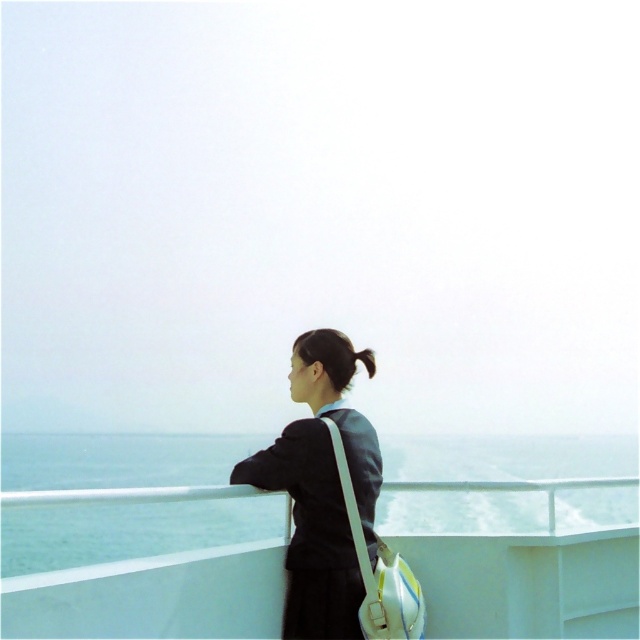
I want to click on matte black jacket at center, so click(x=321, y=490).

Based on the photo, is matte black jacket at center taller than black silky hair at upper center?

Correct, matte black jacket at center is much taller as black silky hair at upper center.

The image size is (640, 640). What do you see at coordinates (321, 490) in the screenshot?
I see `matte black jacket at center` at bounding box center [321, 490].

You are a GUI agent. You are given a task and a screenshot of the screen. Output one action in this format:
    pyautogui.click(x=<x>, y=<y>)
    Task: Click on the matte black jacket at center
    
    Given the screenshot: What is the action you would take?
    pyautogui.click(x=321, y=490)

Which is behind, point (205, 444) or point (364, 364)?

The point (205, 444) is behind.

Can you confirm if blue water at center is taller than black silky hair at upper center?

Correct, blue water at center is much taller as black silky hair at upper center.

Based on the photo, who is more distant from viewer, (96,476) or (362,349)?

Positioned behind is point (96,476).

This screenshot has height=640, width=640. In order to click on blue water at center in this screenshot , I will do `click(490, 477)`.

Is blue water at center shorter than matte black jacket at center?

Incorrect, blue water at center's height does not fall short of matte black jacket at center's.

Does point (380, 518) come farther from viewer compared to point (280, 440)?

Yes.

Where is `blue water at center`? This screenshot has height=640, width=640. blue water at center is located at coordinates (490, 477).

This screenshot has width=640, height=640. In order to click on blue water at center in this screenshot , I will do `click(490, 477)`.